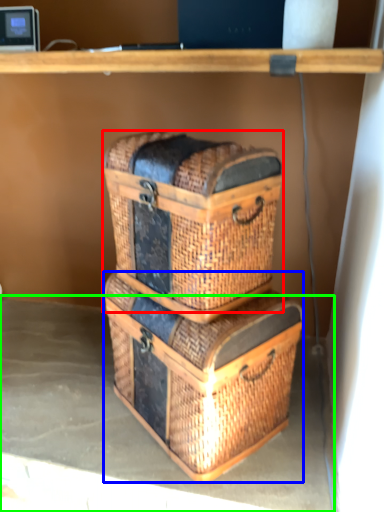
Question: Estimate the real-world distances between objects in this image. Which object is closer to basket container (highlighted by a red box), crate (highlighted by a blue box) or concrete (highlighted by a green box)?

Choices:
 (A) crate
 (B) concrete

Answer: (A)